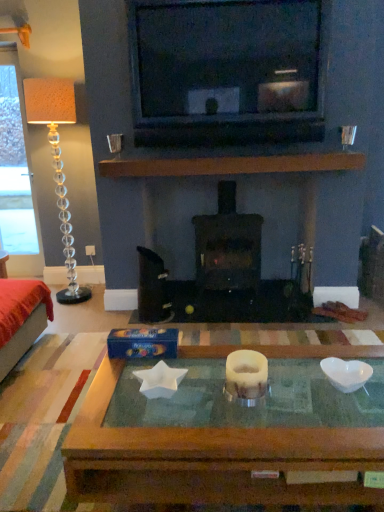
Question: From the image's perspective, relative to translucent glass floor lamp at left, is velvet red ottoman at left above or below?

Choices:
 (A) below
 (B) above

Answer: (A)

Question: Which is correct: velvet red ottoman at left is inside translucent glass floor lamp at left, or outside of it?

Choices:
 (A) inside
 (B) outside

Answer: (B)

Question: Based on their relative distances, which object is farther from the black matte wood burning stove at center?

Choices:
 (A) velvet red ottoman at left
 (B) translucent glass floor lamp at left
 (C) translucent glass coffee table at center

Answer: (C)

Question: Estimate the real-world distances between objects in this image. Which object is farther from the velvet red ottoman at left?

Choices:
 (A) black matte wood burning stove at center
 (B) translucent glass floor lamp at left
 (C) translucent glass coffee table at center

Answer: (A)